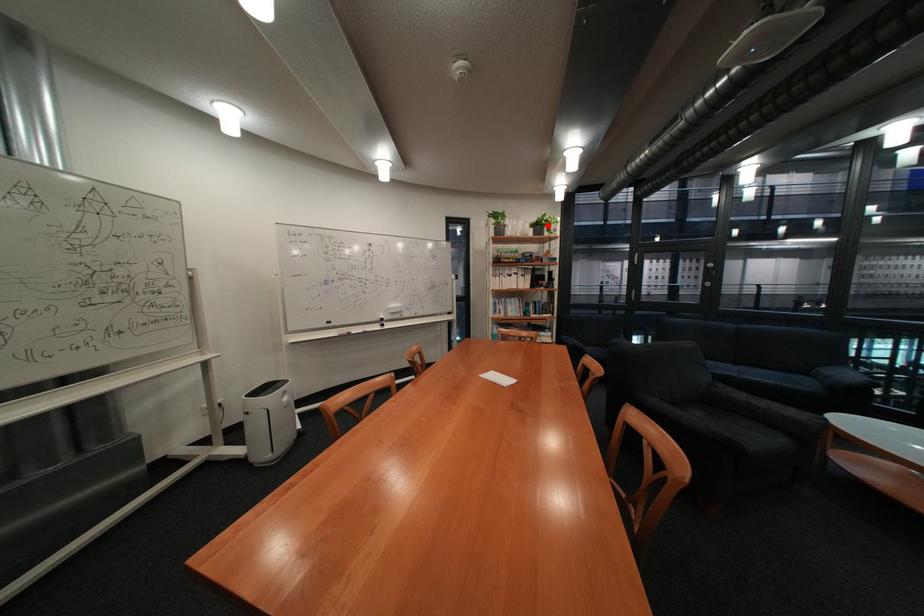
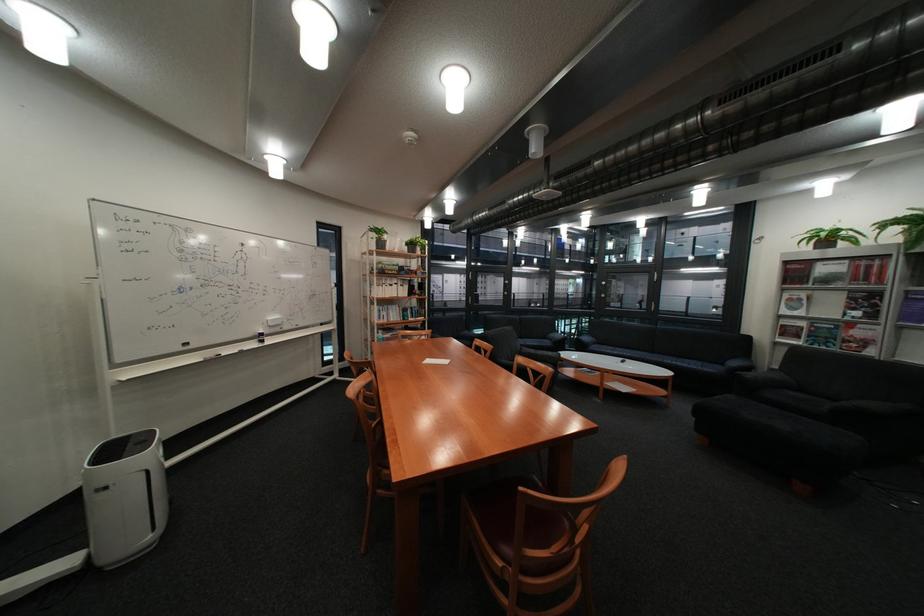
In the second image, find the point that corresponds to the highlighted location in the first image.

(421, 245)